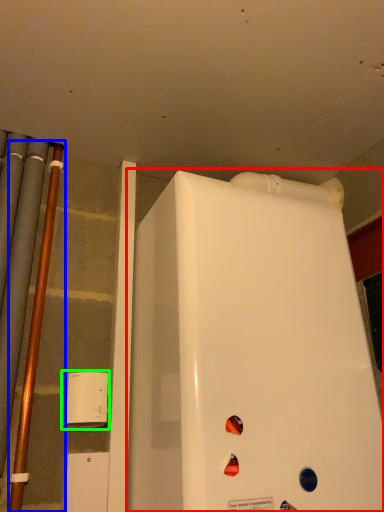
Question: Estimate the real-world distances between objects in this image. Which object is closer to refrigerator (highlighted by a red box), pipe (highlighted by a blue box) or appliance (highlighted by a green box)?

Choices:
 (A) pipe
 (B) appliance

Answer: (B)